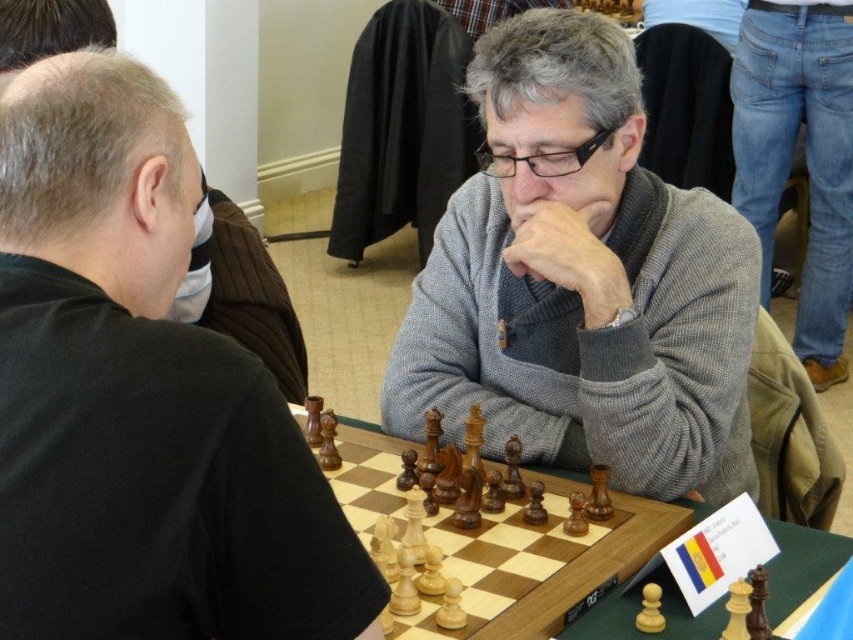
Is black matte chess pieces at left shorter than gray wool sweater at center?

Yes.

Can you confirm if black matte chess pieces at left is bigger than gray wool sweater at center?

Actually, black matte chess pieces at left might be smaller than gray wool sweater at center.

What do you see at coordinates (140, 396) in the screenshot?
I see `black matte chess pieces at left` at bounding box center [140, 396].

Image resolution: width=853 pixels, height=640 pixels. In order to click on black matte chess pieces at left in this screenshot , I will do `click(140, 396)`.